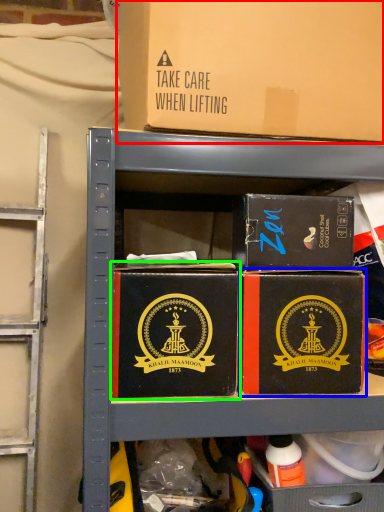
Question: Which object is the closest to the box (highlighted by a red box)? Choose among these: box (highlighted by a blue box) or box (highlighted by a green box).

Choices:
 (A) box
 (B) box

Answer: (A)